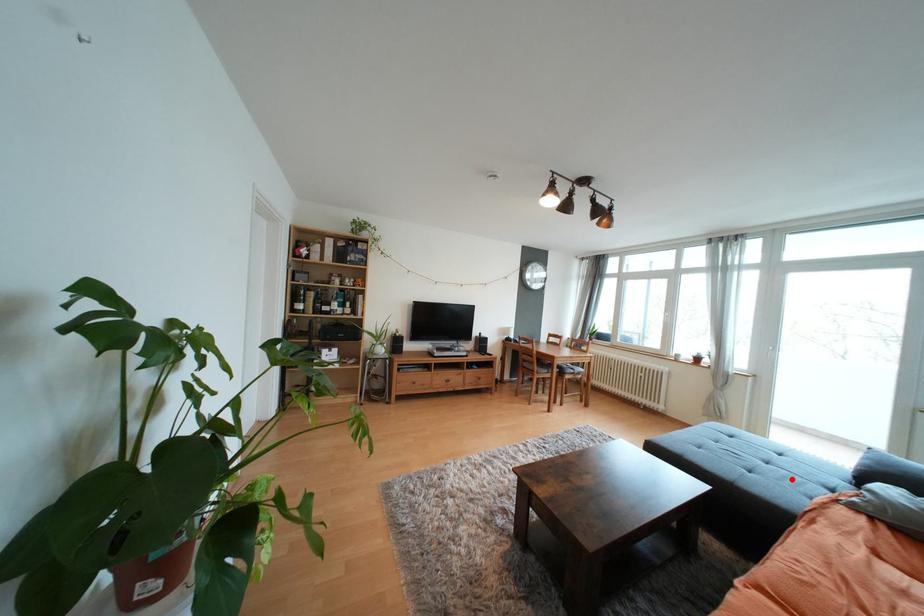
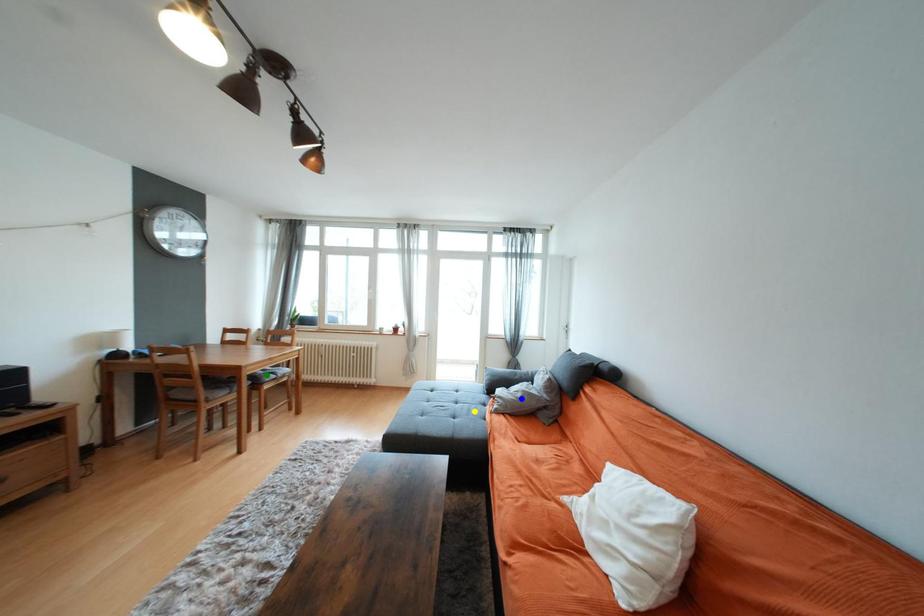
Question: I am providing you with two images of the same scene from different viewpoints. A red point is marked on the first image. You are given multiple points on the second image. Which point in image 2 represents the same 3d spot as the red point in image 1?

Choices:
 (A) blue point
 (B) yellow point
 (C) green point

Answer: (B)